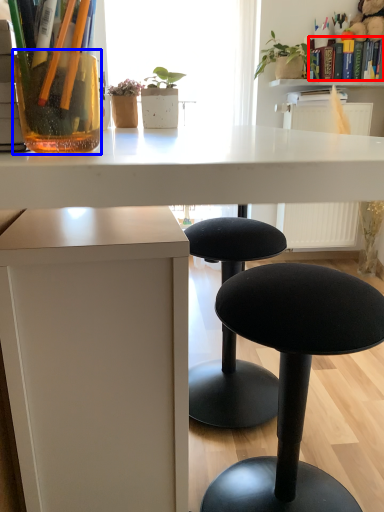
Question: Which object is further to the camera taking this photo, book (highlighted by a red box) or vase (highlighted by a blue box)?

Choices:
 (A) book
 (B) vase

Answer: (A)